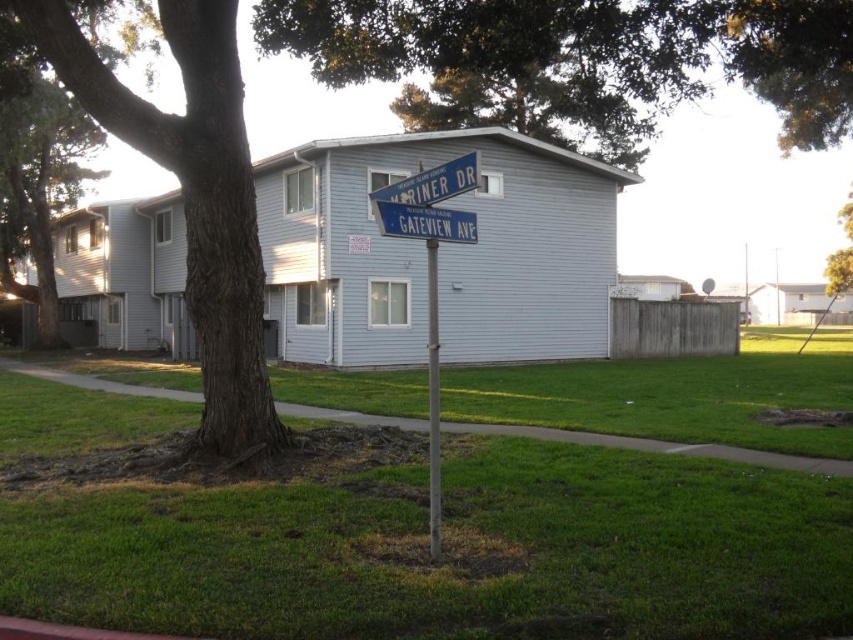
You are standing in the suburban area and want to take a photo of the yellow leafy tree at upper right. To get a clear shot, you need to move away from the green grass at center. Should you move towards the building or away from it?

The green grass at center is closer to the viewer than the yellow leafy tree at upper right. To move away from the green grass at center and get a clearer shot of the yellow leafy tree at upper right, you should move towards the building, as the tree is further away from the grass and thus moving towards the building would position you farther from the grass and closer to the tree.

You are a city planner assessing the visibility of the blue plastic street sign at center. Considering the brown rough bark tree at left, is there a risk that its height might obstruct the view of the sign from the road?

The brown rough bark tree at left is taller than the blue plastic street sign at center, which could potentially obstruct the view of the sign from the road depending on their relative positions.

You are a gardener planning to mow the lawn around the metallic pole at center and the green grass at center. Which area requires a wider path to mow?

The green grass at center requires a wider path to mow because its width is larger than the metallic pole at center.